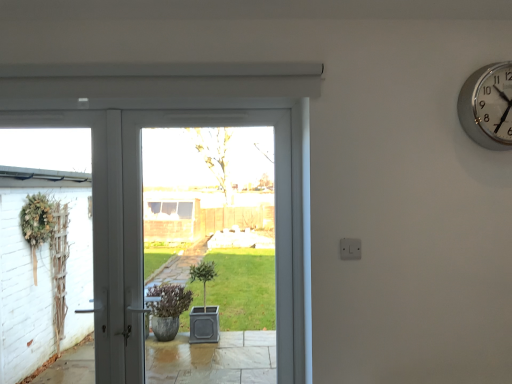
Question: Does white glossy door at center have a greater width compared to silver metallic wall clock at upper right?

Choices:
 (A) no
 (B) yes

Answer: (B)

Question: Considering the relative positions of white glossy door at center and silver metallic wall clock at upper right in the image provided, is white glossy door at center to the left of silver metallic wall clock at upper right from the viewer's perspective?

Choices:
 (A) yes
 (B) no

Answer: (A)

Question: Could silver metallic wall clock at upper right be considered to be inside white glossy door at center?

Choices:
 (A) yes
 (B) no

Answer: (B)

Question: Is white glossy door at center shorter than silver metallic wall clock at upper right?

Choices:
 (A) no
 (B) yes

Answer: (A)

Question: Is white glossy door at center positioned behind silver metallic wall clock at upper right?

Choices:
 (A) yes
 (B) no

Answer: (A)

Question: From the image's perspective, would you say white glossy door at center is positioned over silver metallic wall clock at upper right?

Choices:
 (A) no
 (B) yes

Answer: (A)

Question: Can you confirm if silver metallic wall clock at upper right is wider than white glossy door at center?

Choices:
 (A) yes
 (B) no

Answer: (B)

Question: Is silver metallic wall clock at upper right oriented towards white glossy door at center?

Choices:
 (A) yes
 (B) no

Answer: (B)

Question: From a real-world perspective, does silver metallic wall clock at upper right stand above white glossy door at center?

Choices:
 (A) yes
 (B) no

Answer: (A)

Question: From the image's perspective, would you say silver metallic wall clock at upper right is shown under white glossy door at center?

Choices:
 (A) yes
 (B) no

Answer: (B)

Question: Is silver metallic wall clock at upper right touching white glossy door at center?

Choices:
 (A) no
 (B) yes

Answer: (A)

Question: Does silver metallic wall clock at upper right have a greater height compared to white glossy door at center?

Choices:
 (A) no
 (B) yes

Answer: (A)

Question: Considering the positions of silver metallic wall clock at upper right and white glossy door at center in the image, is silver metallic wall clock at upper right taller or shorter than white glossy door at center?

Choices:
 (A) tall
 (B) short

Answer: (B)